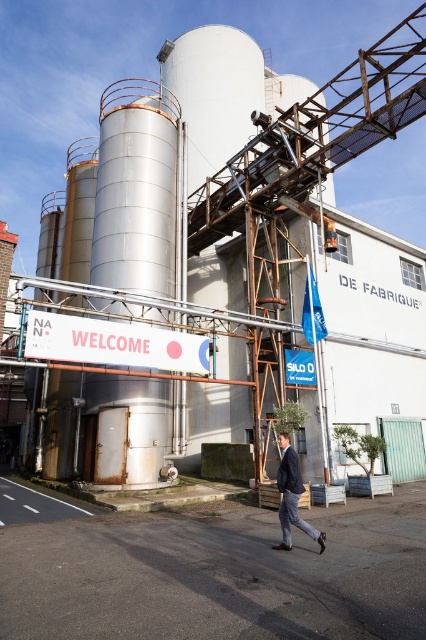
Does point (83, 300) come farther from viewer compared to point (290, 497)?

That is True.

Who is more forward, (189, 106) or (278, 477)?

Positioned in front is point (278, 477).

Locate an element on the screen. metallic silo at center is located at coordinates click(x=233, y=266).